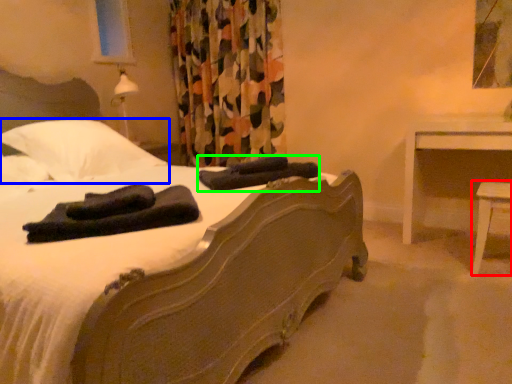
Question: Estimate the real-world distances between objects in this image. Which object is closer to table (highlighted by a red box), pillow (highlighted by a blue box) or material (highlighted by a green box)?

Choices:
 (A) pillow
 (B) material

Answer: (B)